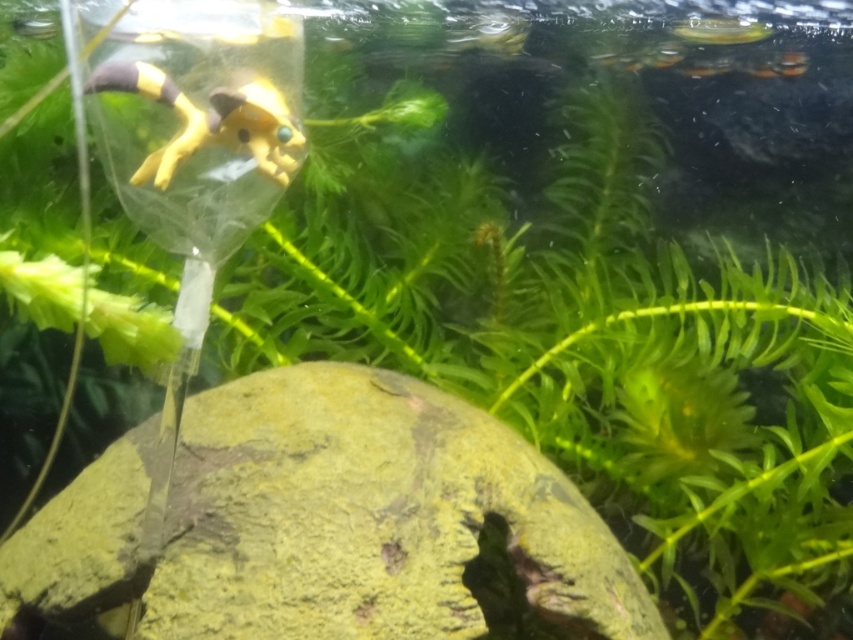
You are a diver exploring this underwater scene. You need to place a small sensor on the taller object between the green mossy rock at center and the yellow matte toy at upper left. Which object should you choose?

The green mossy rock at center is taller than the yellow matte toy at upper left, so you should place the sensor on the green mossy rock at center.

You are a child who wants to catch the translucent plastic fish at upper right with your yellow matte toy at upper left. Can you reach the fish with the toy?

The yellow matte toy at upper left is to the left of the translucent plastic fish at upper right, so the child can reach the fish with the toy.